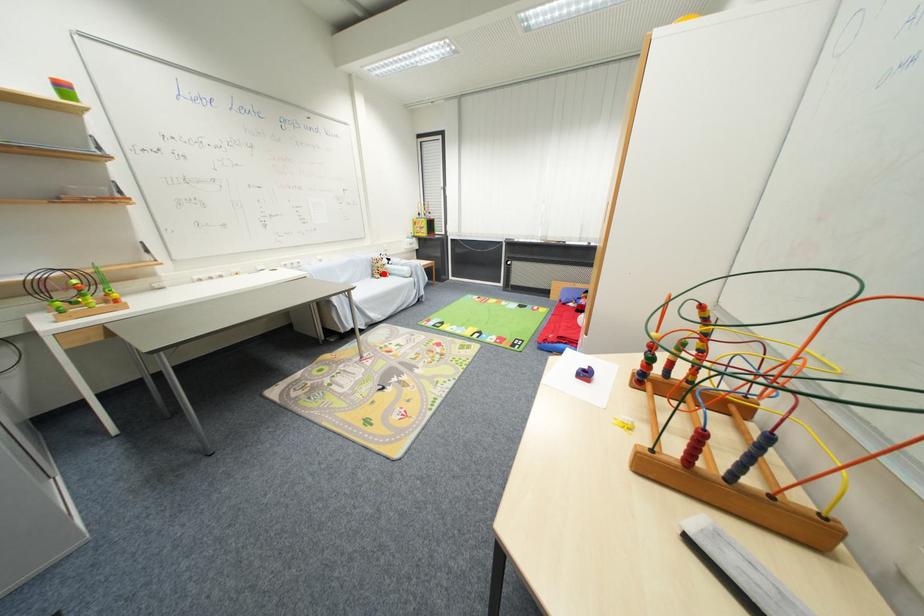
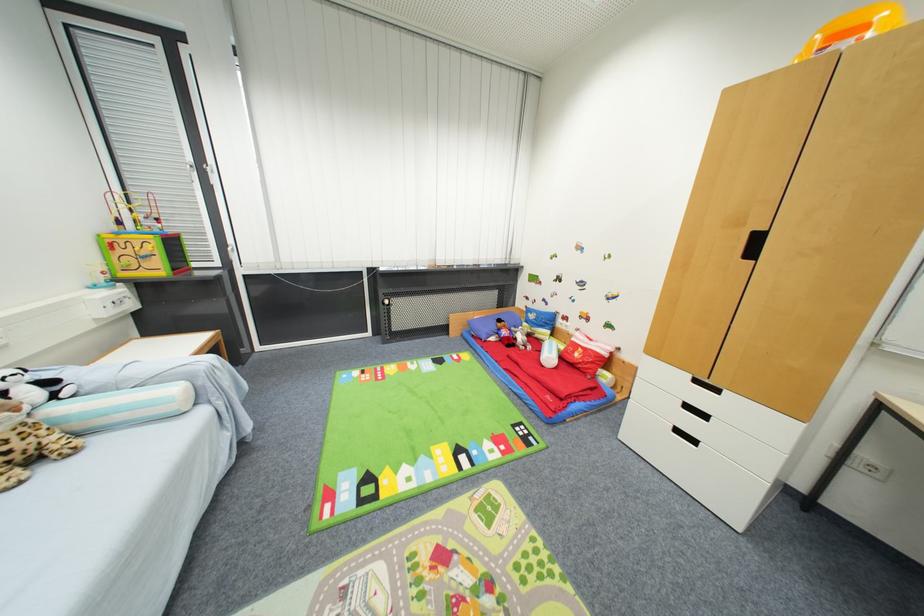
The point at the highlighted location is marked in the first image. Where is the corresponding point in the second image?

(7, 456)